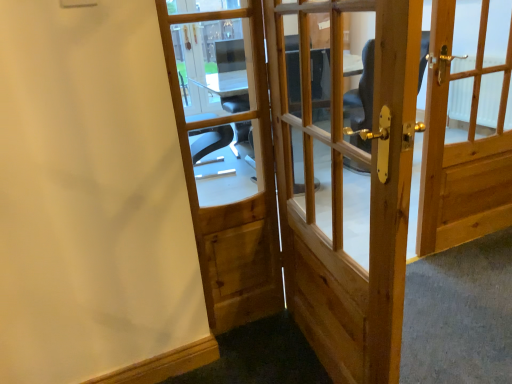
Question: From the image's perspective, is natural wood door at right, the 3th door when ordered from left to right, beneath natural wood door at center, the 1th door viewed from the left?

Choices:
 (A) no
 (B) yes

Answer: (A)

Question: Would you say natural wood door at right, the 3th door when ordered from left to right, contains natural wood door at center, which is counted as the third door, starting from the right?

Choices:
 (A) yes
 (B) no

Answer: (B)

Question: Does natural wood door at right, the 3th door when ordered from left to right, have a greater width compared to natural wood door at center, the 1th door viewed from the left?

Choices:
 (A) no
 (B) yes

Answer: (B)

Question: Could you tell me if natural wood door at right, the 3th door when ordered from left to right, is turned towards natural wood door at center, the 1th door viewed from the left?

Choices:
 (A) no
 (B) yes

Answer: (A)

Question: Does natural wood door at right, which is the first door from right to left, have a greater height compared to natural wood door at center, the 1th door viewed from the left?

Choices:
 (A) no
 (B) yes

Answer: (A)

Question: Is natural wood door at center, the 1th door viewed from the left, inside the boundaries of natural wood door at right, which is the first door from right to left, or outside?

Choices:
 (A) outside
 (B) inside

Answer: (A)

Question: In terms of height, does natural wood door at center, which is counted as the third door, starting from the right, look taller or shorter compared to natural wood door at right, the 3th door when ordered from left to right?

Choices:
 (A) short
 (B) tall

Answer: (B)

Question: Relative to natural wood door at right, which is the first door from right to left, is natural wood door at center, which is counted as the third door, starting from the right, in front or behind?

Choices:
 (A) front
 (B) behind

Answer: (A)

Question: Based on their positions, is natural wood door at center, which is counted as the third door, starting from the right, located to the left or right of natural wood door at right, the 3th door when ordered from left to right?

Choices:
 (A) left
 (B) right

Answer: (A)

Question: From a real-world perspective, is natural wood door at center, the 2th door when ordered from right to left, positioned above or below natural wood door at center, which is counted as the third door, starting from the right?

Choices:
 (A) below
 (B) above

Answer: (A)

Question: Considering the positions of point (379, 1) and point (271, 266), is point (379, 1) closer or farther from the camera than point (271, 266)?

Choices:
 (A) farther
 (B) closer

Answer: (B)

Question: From the image's perspective, is natural wood door at center, which appears as the 2th door when viewed from the left, located above or below natural wood door at center, which is counted as the third door, starting from the right?

Choices:
 (A) below
 (B) above

Answer: (A)

Question: Which is correct: natural wood door at center, which appears as the 2th door when viewed from the left, is inside natural wood door at center, which is counted as the third door, starting from the right, or outside of it?

Choices:
 (A) outside
 (B) inside

Answer: (A)

Question: From the image's perspective, is natural wood door at right, which is the first door from right to left, positioned above or below natural wood door at center, which appears as the 2th door when viewed from the left?

Choices:
 (A) below
 (B) above

Answer: (B)

Question: Is point click(454, 49) closer or farther from the camera than point click(352, 274)?

Choices:
 (A) closer
 (B) farther

Answer: (B)